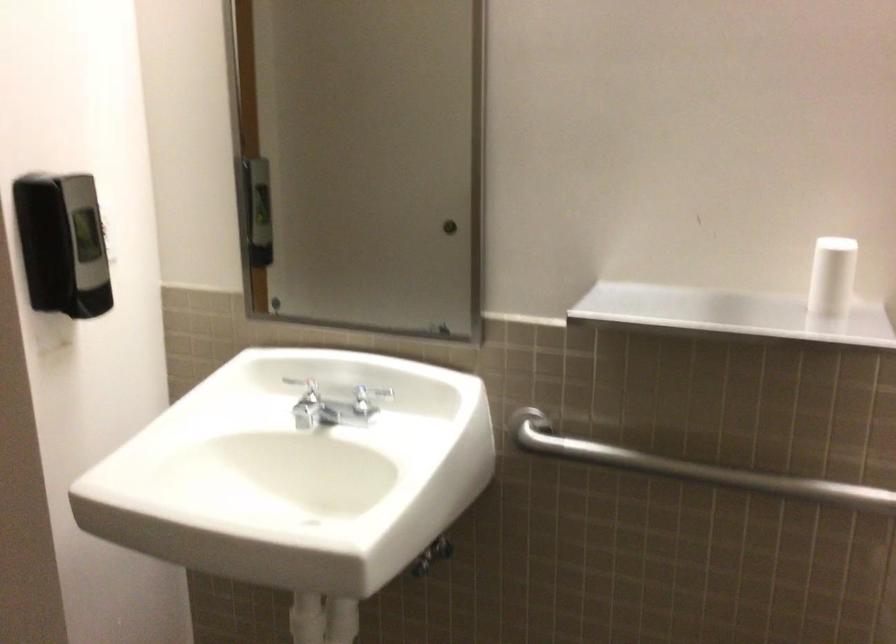
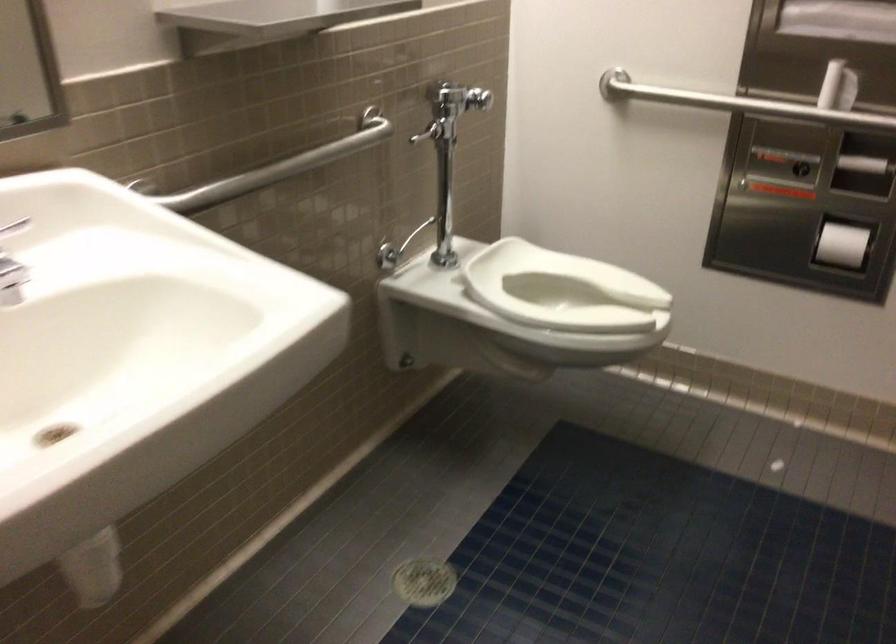
Locate, in the second image, the point that corresponds to point 666,458 in the first image.

(277, 167)